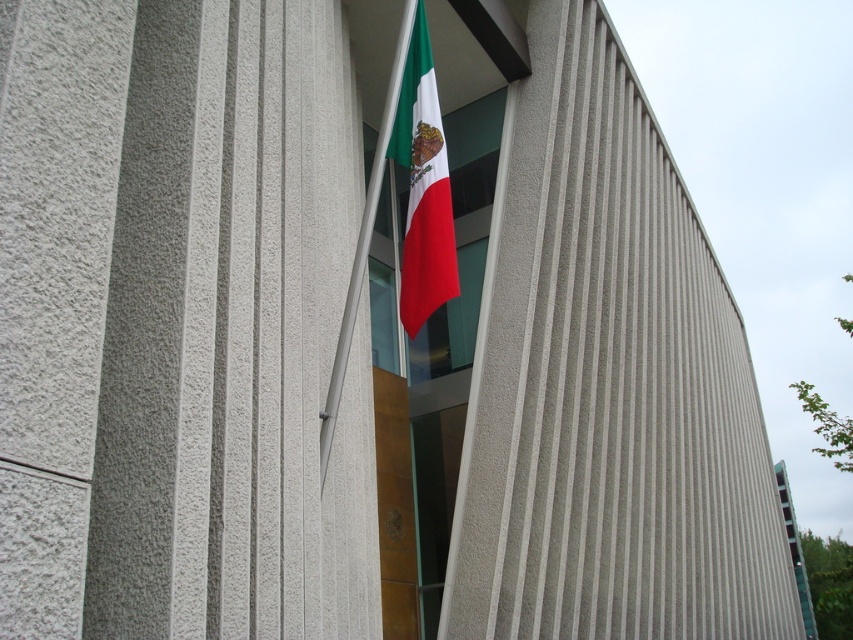
You are standing in front of the building and notice two points on the wall. The first point is at coordinates point (383, 358) and the second is at point (410, 291). Which point is closer to you?

Point (383, 358) is further to the camera than point (410, 291), so the second point is closer to you.

You are standing in front of the modern building with the Mexican flag. There is a point marked at coordinates (462, 236). What is the nearest object to this point?

The point at (462, 236) is on the glass window at center, so the nearest object to this point is the glass window at center.